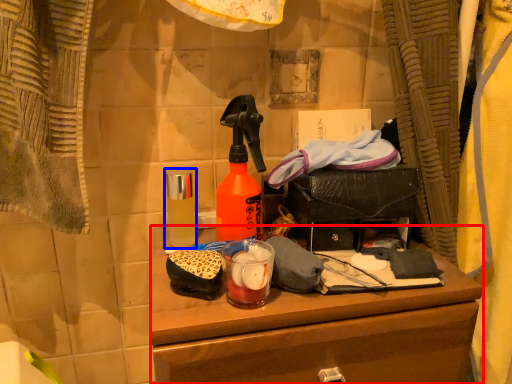
Question: Which point is closer to the camera, desk (highlighted by a red box) or bottle (highlighted by a blue box)?

Choices:
 (A) desk
 (B) bottle

Answer: (A)